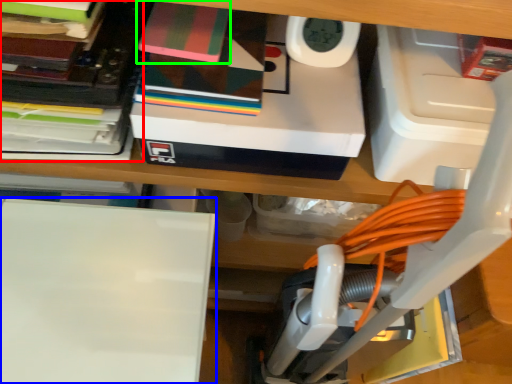
Question: Estimate the real-world distances between objects in this image. Which object is farther from book (highlighted by a red box), wide (highlighted by a blue box) or paperback book (highlighted by a green box)?

Choices:
 (A) wide
 (B) paperback book

Answer: (A)